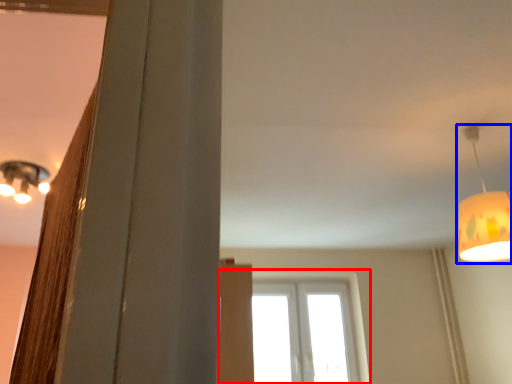
Question: Which of the following is the closest to the observer, window (highlighted by a red box) or lamp (highlighted by a blue box)?

Choices:
 (A) window
 (B) lamp

Answer: (B)